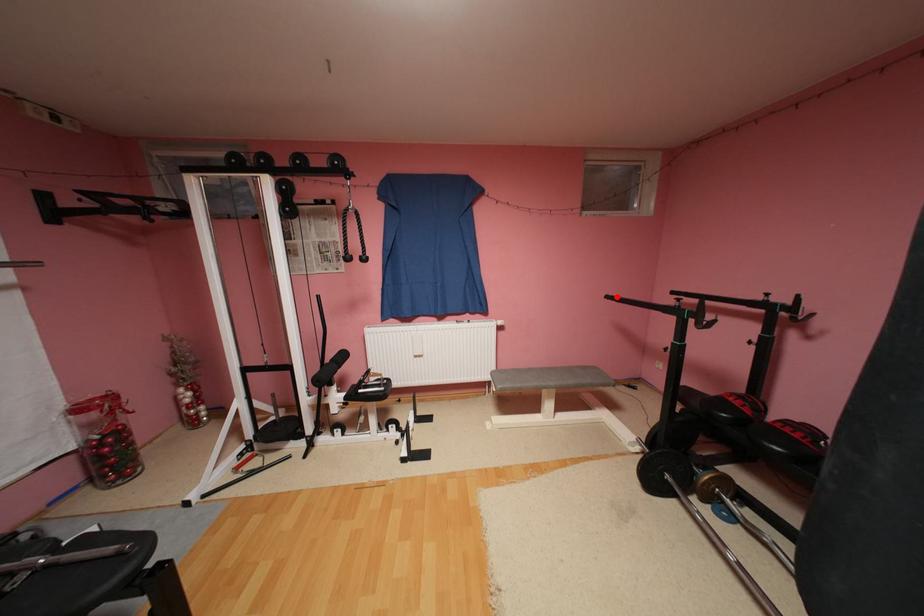
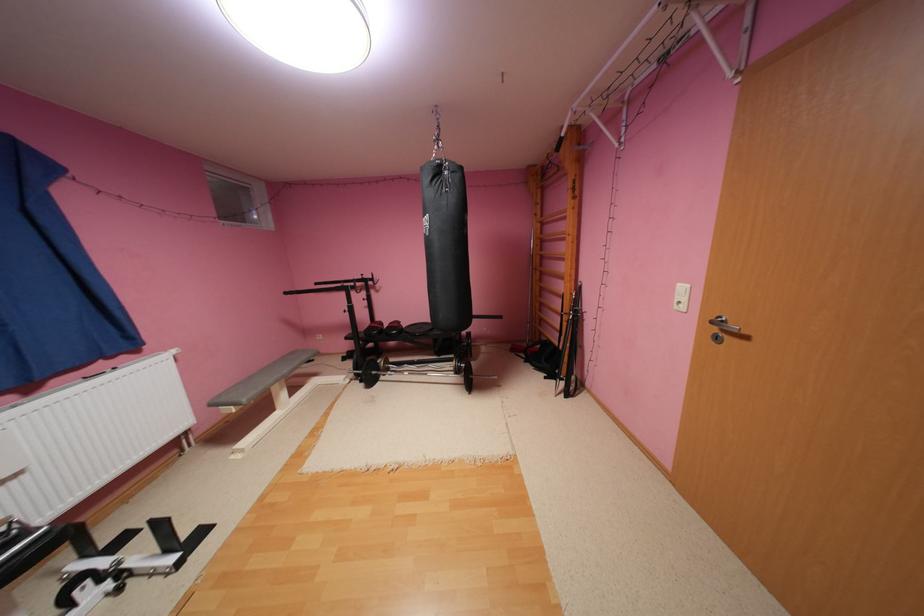
Find the pixel in the second image that matches the highlighted location in the first image.

(295, 293)